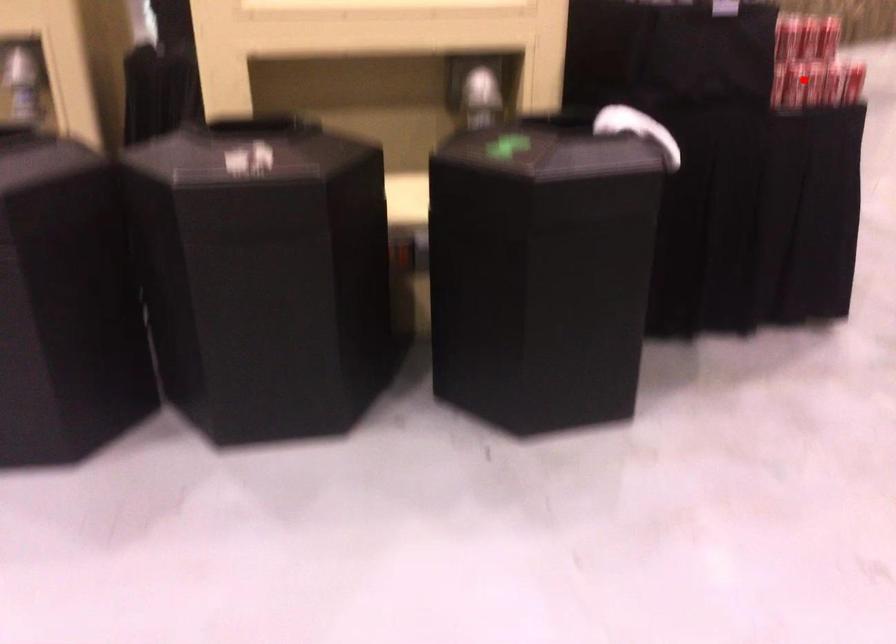
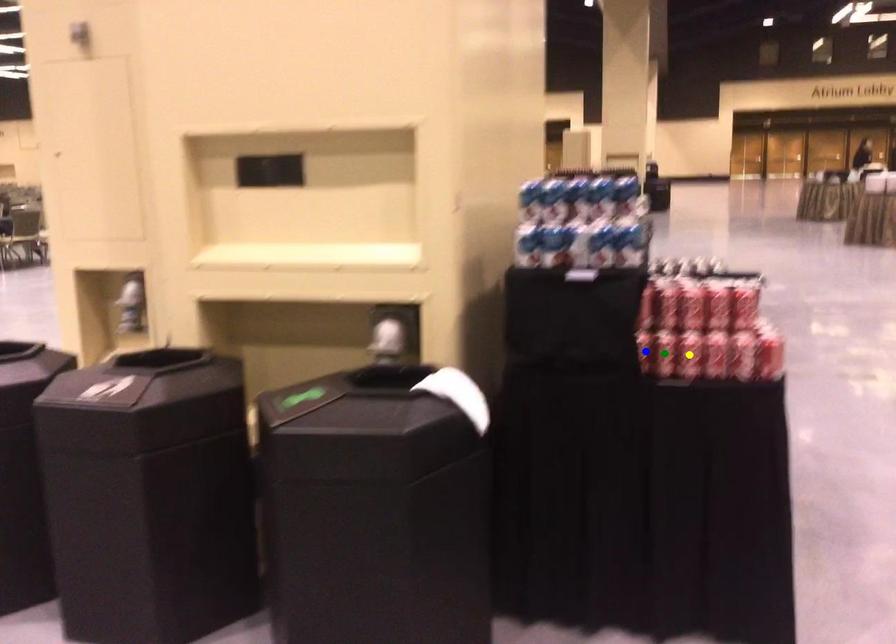
Question: I am providing you with two images of the same scene from different viewpoints. A red point is marked on the first image. You are given multiple points on the second image. Which mark in image 2 goes with the point in image 1?

Choices:
 (A) green point
 (B) yellow point
 (C) blue point

Answer: (B)